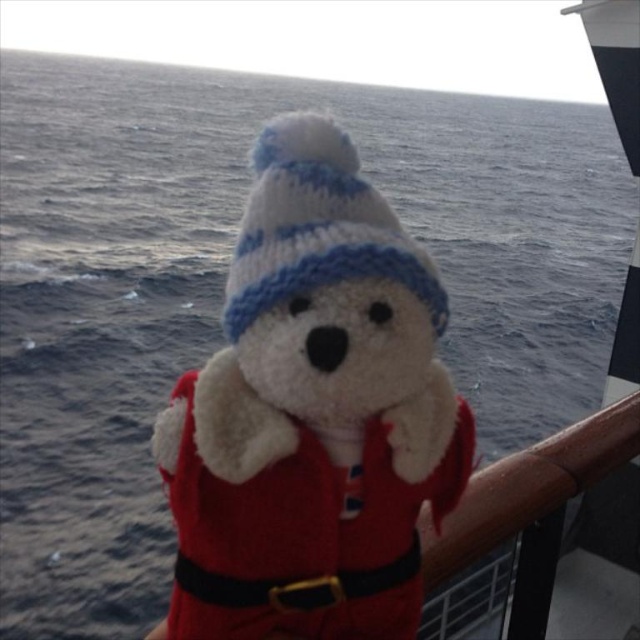
Question: Which point appears closest to the camera in this image?

Choices:
 (A) (212, 602)
 (B) (330, 134)

Answer: (B)

Question: Which point is closer to the camera?

Choices:
 (A) white plush santa claus at center
 (B) white knitted hat at center

Answer: (A)

Question: Is white plush santa claus at center positioned behind white knitted hat at center?

Choices:
 (A) yes
 (B) no

Answer: (B)

Question: Is white plush santa claus at center to the left of white knitted hat at center from the viewer's perspective?

Choices:
 (A) yes
 (B) no

Answer: (B)

Question: Is the position of white plush santa claus at center less distant than that of white knitted hat at center?

Choices:
 (A) no
 (B) yes

Answer: (B)